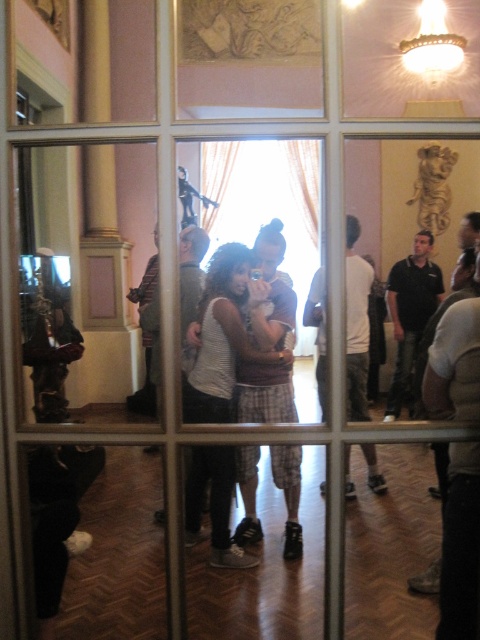
Which is below, striped fabric shirt at center or white cotton shirt at center?

striped fabric shirt at center

Is point (213, 376) closer to viewer compared to point (348, 264)?

Yes, point (213, 376) is in front of point (348, 264).

Locate an element on the screen. Image resolution: width=480 pixels, height=640 pixels. striped fabric shirt at center is located at coordinates (222, 339).

Does striped fabric shirt at center appear on the right side of black cotton shirt at center?

In fact, striped fabric shirt at center is to the left of black cotton shirt at center.

Can you confirm if striped fabric shirt at center is smaller than black cotton shirt at center?

Correct, striped fabric shirt at center occupies less space than black cotton shirt at center.

Locate an element on the screen. This screenshot has width=480, height=640. striped fabric shirt at center is located at coordinates (222, 339).

Which is more to the right, white cotton shirt at center or black cotton shirt at center?

Positioned to the right is black cotton shirt at center.

Does white cotton shirt at center appear on the right side of black cotton shirt at center?

In fact, white cotton shirt at center is to the left of black cotton shirt at center.

Is point (350, 312) positioned before point (418, 250)?

Yes, it is in front of point (418, 250).

The width and height of the screenshot is (480, 640). In order to click on white cotton shirt at center in this screenshot , I will do `click(357, 324)`.